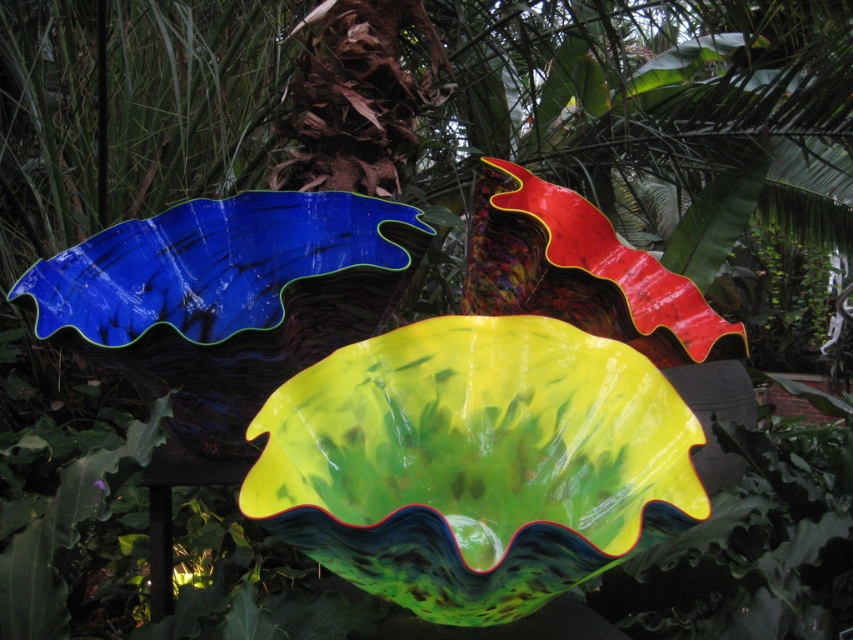
Between point (480, 394) and point (576, 248), which one is positioned behind?

Point (576, 248)

Which is behind, point (572, 416) or point (659, 358)?

Point (659, 358)

Where is `green glossy glass bowl at center`? green glossy glass bowl at center is located at coordinates (474, 464).